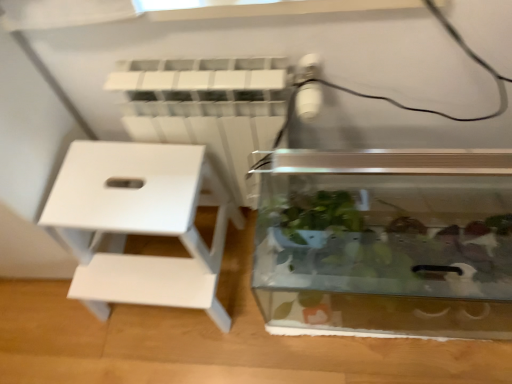
Find the location of a particular element. vacant area that is in front of white matte stool at left is located at coordinates (199, 356).